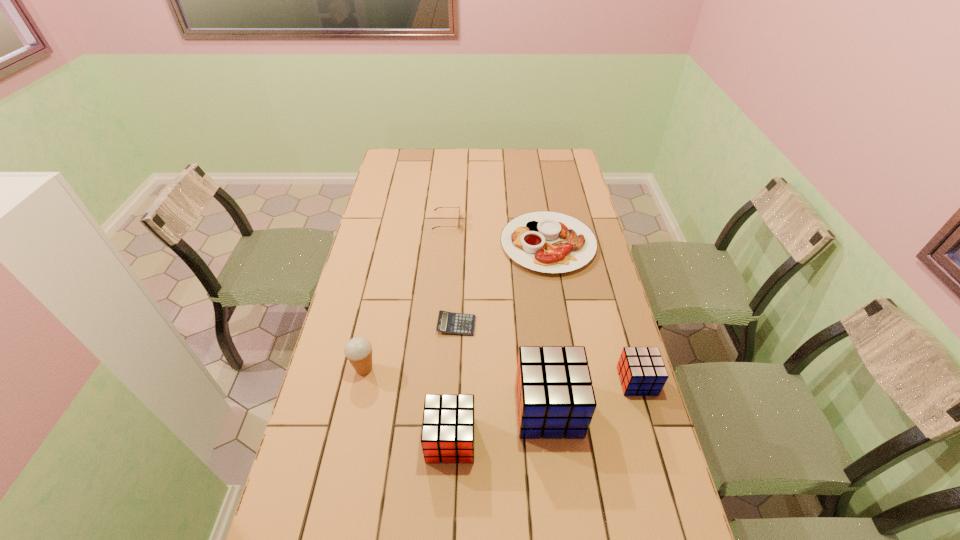
The cubes are evenly distributed in the image. To maintain this, where would you place another cube on the left? Please point to a free space. Please provide its 2D coordinates. Your answer should be formatted as a tuple, i.e. [(x, y)], where the tuple contains the x and y coordinates of a point satisfying the conditions above.

[(342, 475)]